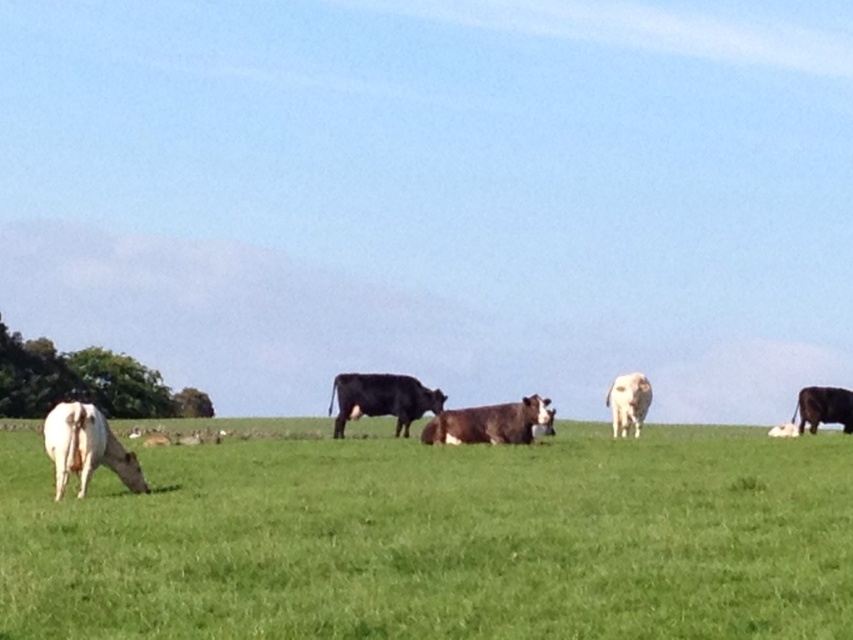
You are a photographer trying to capture the shiny black cow at center. You notice a point marked at coordinates (381, 400) in the image. Based on the scene description, where is this point located?

The point at coordinates (381, 400) is on the shiny black cow at center.

You are a farmer checking the pasture. You notice the brown smooth cow at center and the shiny brown cow at right. Which cow is shorter in height?

The brown smooth cow at center is shorter than the shiny brown cow at right.